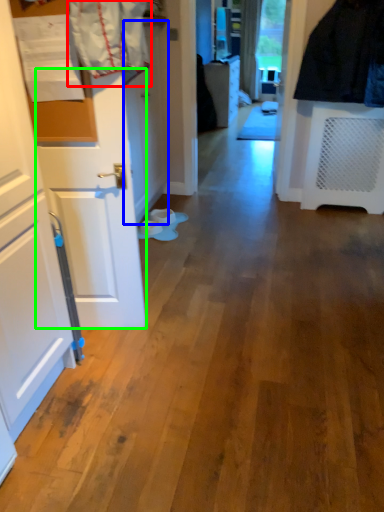
Question: Which object is the farthest from laundry (highlighted by a red box)? Choose among these: door (highlighted by a blue box) or door (highlighted by a green box).

Choices:
 (A) door
 (B) door

Answer: (A)